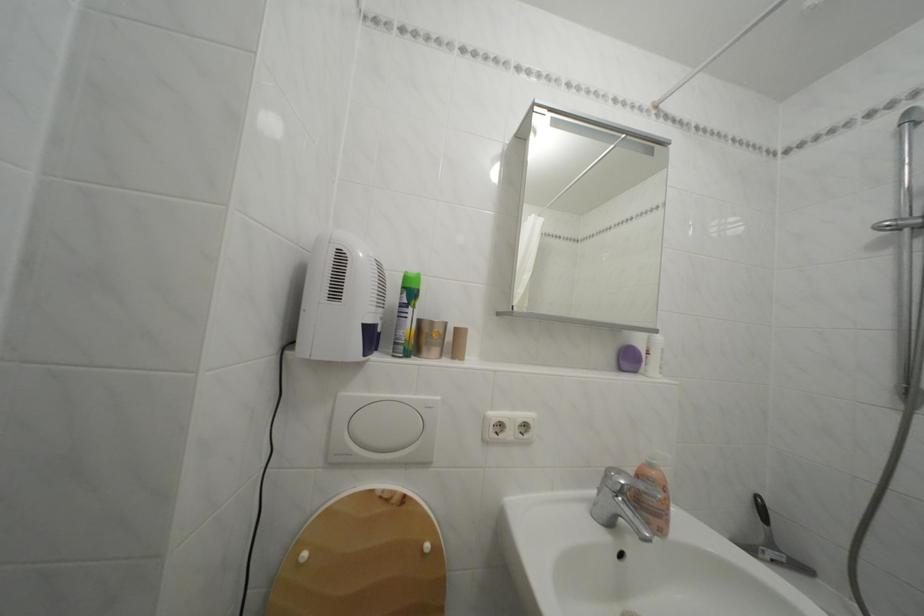
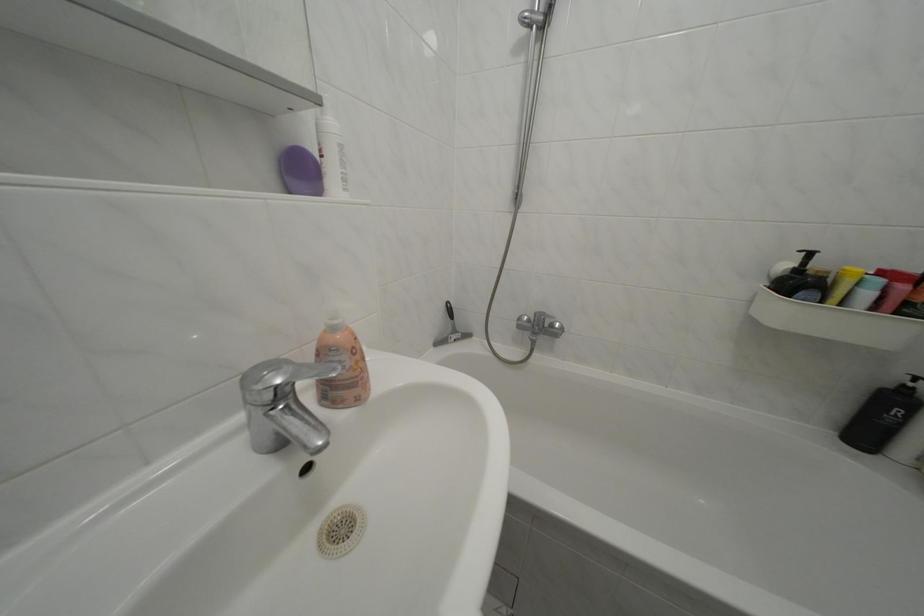
Find the pixel in the second image that matches [616,477] in the first image.

(252, 384)